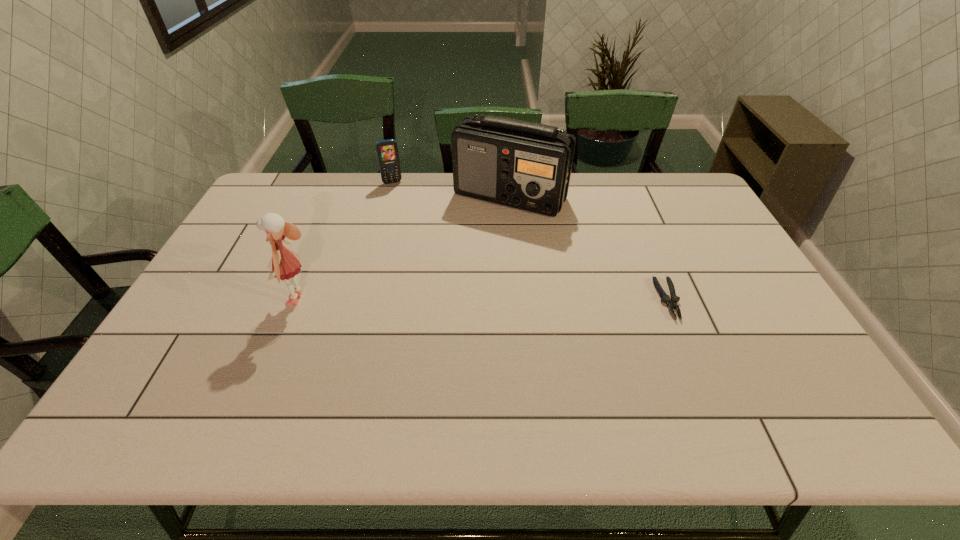
At what (x,y) coordinates should I click in order to perform the action: click on vacant space located 0.080m on the screen of the third tallest object. Please return your answer as a coordinate pair (x, y). This screenshot has height=540, width=960. Looking at the image, I should click on (399, 197).

Where is `vacant space located on the screen of the third tallest object`? The height and width of the screenshot is (540, 960). vacant space located on the screen of the third tallest object is located at coordinates (399, 197).

The width and height of the screenshot is (960, 540). In order to click on vacant space located 0.110m on the screen of the third tallest object in this screenshot , I will do `click(401, 201)`.

At what (x,y) coordinates should I click in order to perform the action: click on free location located on the front panel of the second object from right to left. Please return your answer as a coordinate pair (x, y). The image size is (960, 540). Looking at the image, I should click on (529, 255).

Find the location of a particular element. free spot located on the front panel of the second object from right to left is located at coordinates (537, 283).

Where is `vacant space situated on the front panel of the second object from right to left`? vacant space situated on the front panel of the second object from right to left is located at coordinates (538, 288).

Locate an element on the screen. Image resolution: width=960 pixels, height=540 pixels. cellular telephone at the far edge is located at coordinates (387, 151).

Find the location of a particular element. The width and height of the screenshot is (960, 540). radio receiver that is at the far edge is located at coordinates (525, 165).

In the image, there is a desktop. What are the coordinates of `vacant space at the far edge` in the screenshot? It's located at (352, 187).

Where is `vacant space at the near edge of the desktop`? The image size is (960, 540). vacant space at the near edge of the desktop is located at coordinates (437, 356).